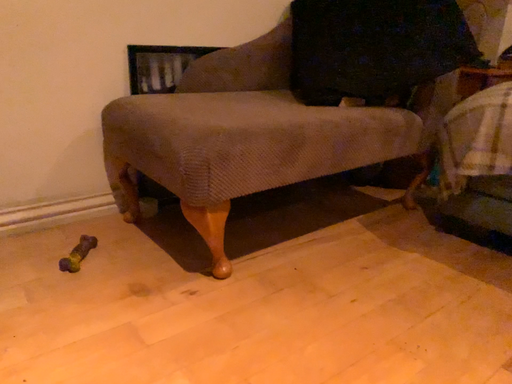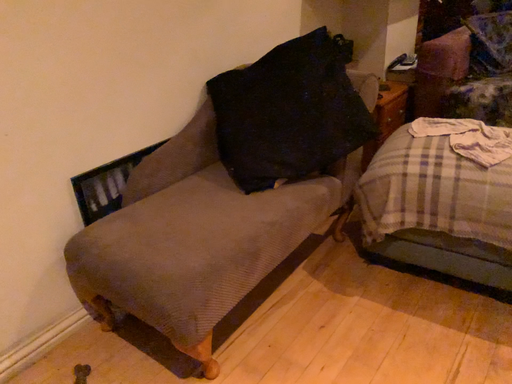
Question: How did the camera likely rotate when shooting the video?

Choices:
 (A) rotated left
 (B) rotated right

Answer: (B)